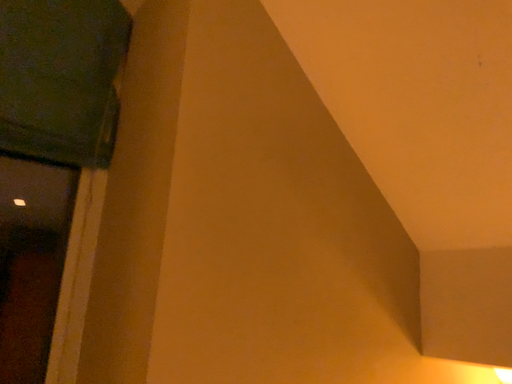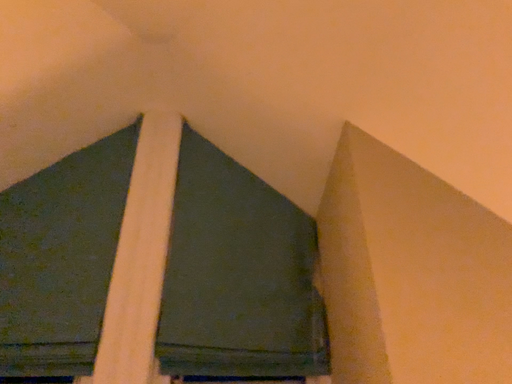
Question: How did the camera likely rotate when shooting the video?

Choices:
 (A) rotated upward
 (B) rotated downward

Answer: (A)